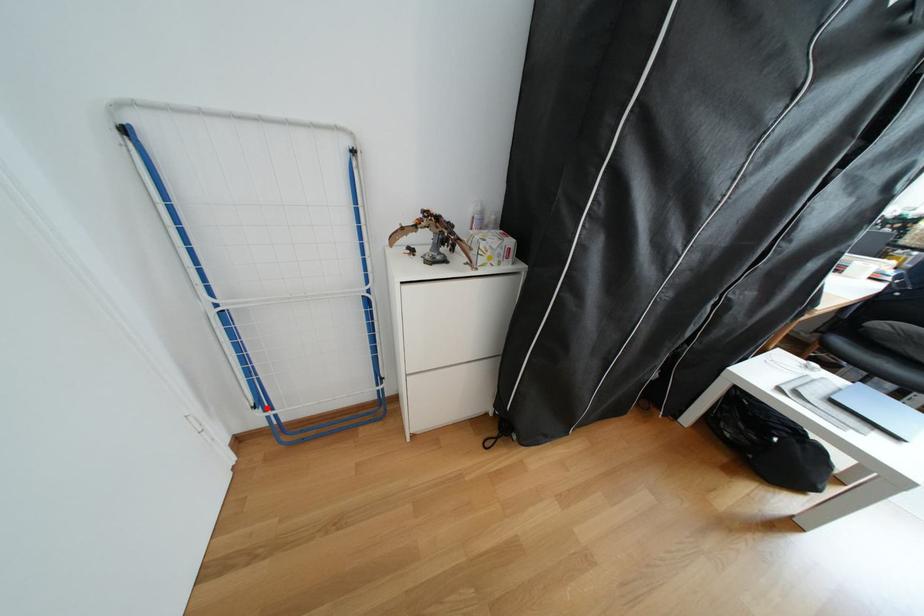
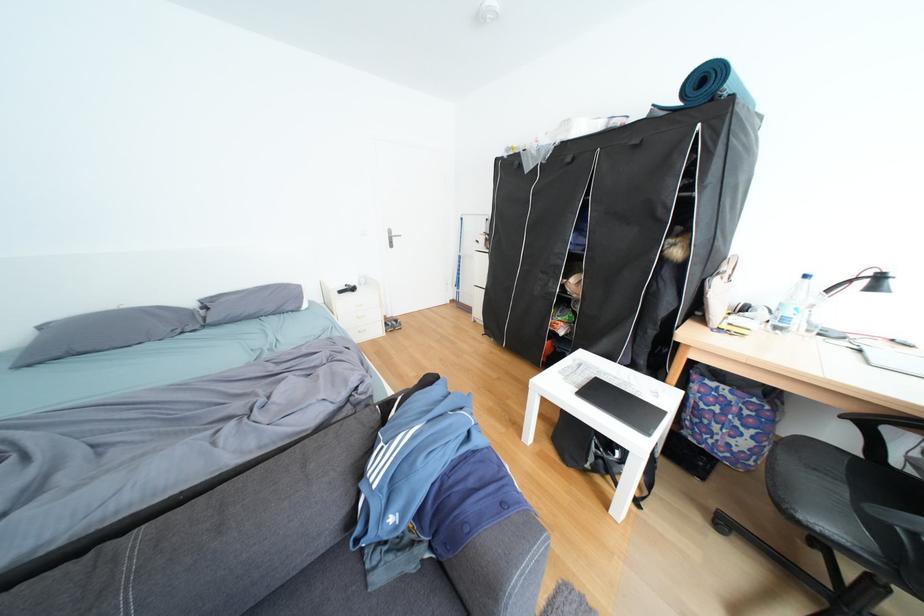
Question: I am providing you with two images of the same scene from different viewpoints. A red point is marked on the first image. Can you still see the location of the red point in image 2?

Choices:
 (A) Yes
 (B) No

Answer: (B)